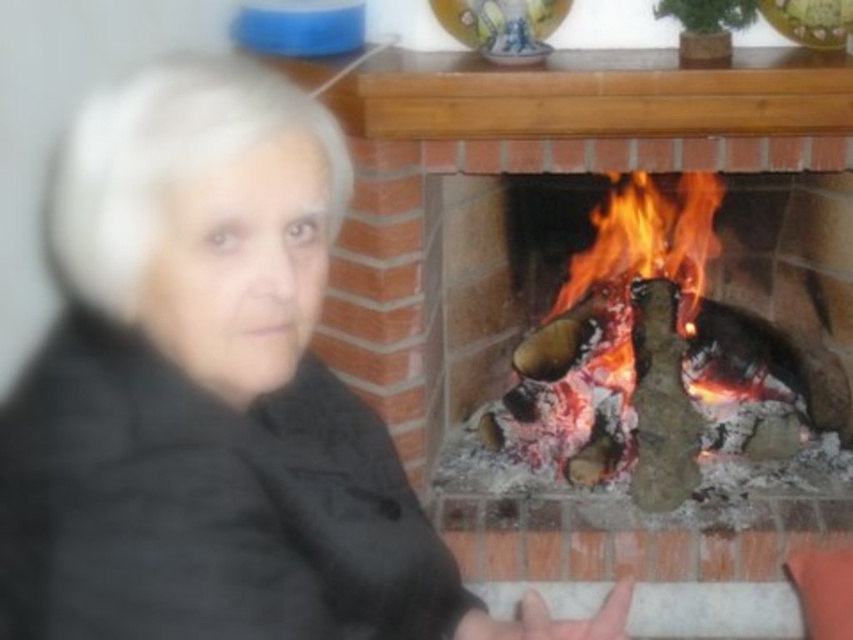
Can you confirm if black quilted jacket at left is positioned below charred wood fire at center?

Correct, black quilted jacket at left is located below charred wood fire at center.

This screenshot has height=640, width=853. What do you see at coordinates (212, 396) in the screenshot? I see `black quilted jacket at left` at bounding box center [212, 396].

Who is more forward, (287, 580) or (706, 252)?

Point (287, 580) is in front.

Where is `black quilted jacket at left`? black quilted jacket at left is located at coordinates (212, 396).